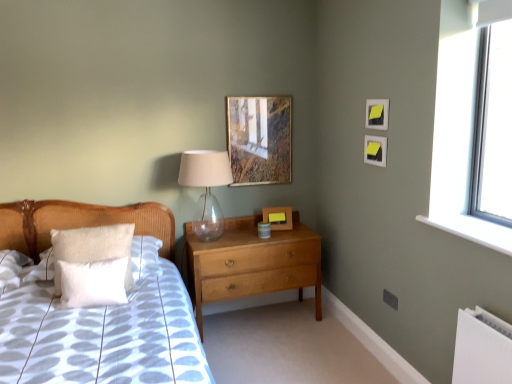
You are a GUI agent. You are given a task and a screenshot of the screen. Output one action in this format:
    pyautogui.click(x=<x>, y=<y>)
    Task: Click on the blank area beneath transparent glass table lamp at upper center (from a real-world perspective)
    The height and width of the screenshot is (384, 512).
    Given the screenshot: What is the action you would take?
    pyautogui.click(x=211, y=238)